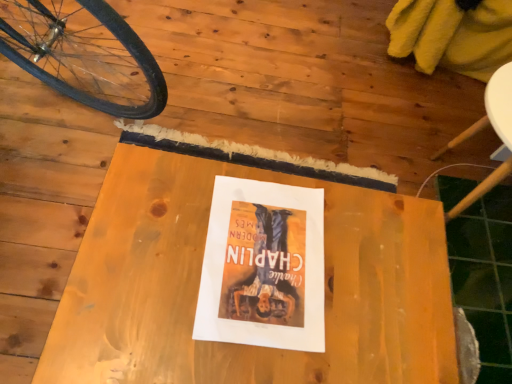
At what (x,y) coordinates should I click in order to perform the action: click on vacant space situated on the left part of white paper at center. Please return your answer as a coordinate pair (x, y). The width and height of the screenshot is (512, 384). Looking at the image, I should click on (x=144, y=241).